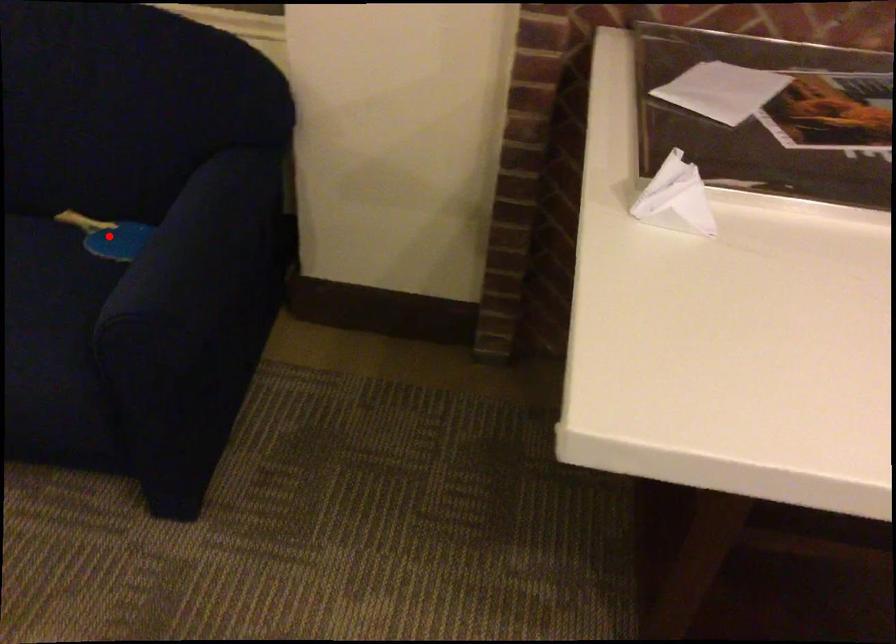
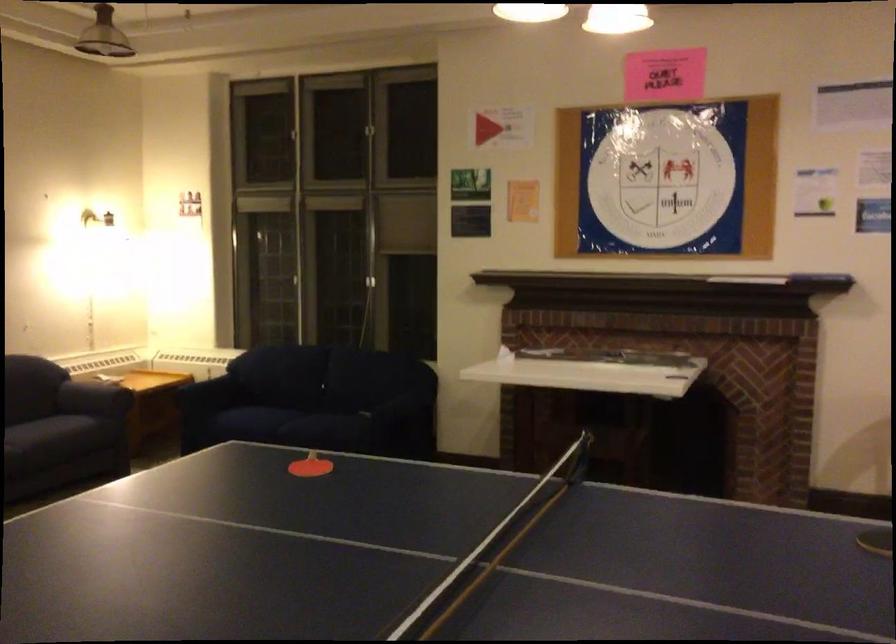
Question: I am providing you with two images of the same scene from different viewpoints. A red point is marked on the first image. Can you still see the location of the red point in image 2?

Choices:
 (A) Yes
 (B) No

Answer: (B)